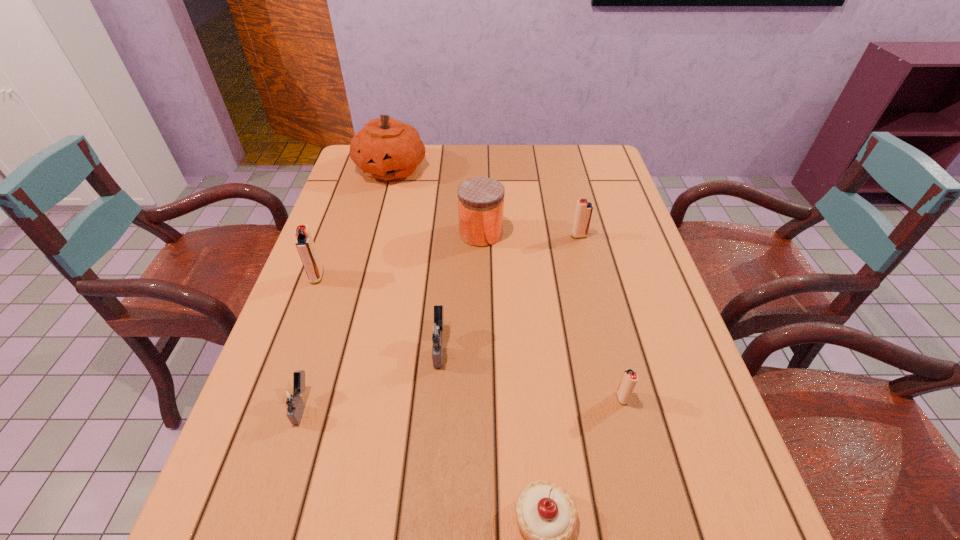
Image resolution: width=960 pixels, height=540 pixels. I want to click on the smaller gray igniter, so click(x=290, y=397).

You are a GUI agent. You are given a task and a screenshot of the screen. Output one action in this format:
    pyautogui.click(x=<x>, y=<y>)
    Task: Click on the fourth igniter from right to left
    The width and height of the screenshot is (960, 540).
    Given the screenshot: What is the action you would take?
    pyautogui.click(x=290, y=397)

You are a GUI agent. You are given a task and a screenshot of the screen. Output one action in this format:
    pyautogui.click(x=<x>, y=<y>)
    Task: Click on the free space located 0.340m on the front-facing side of the pumpkin
    This screenshot has width=960, height=540.
    Given the screenshot: What is the action you would take?
    click(x=366, y=264)

Find the location of a particular element. The height and width of the screenshot is (540, 960). vacant space situated 0.270m on the back of the second farthest igniter is located at coordinates (343, 206).

Image resolution: width=960 pixels, height=540 pixels. Find the location of `free space located 0.180m on the front of the jar`. free space located 0.180m on the front of the jar is located at coordinates coord(481,297).

Image resolution: width=960 pixels, height=540 pixels. I want to click on vacant space located 0.360m on the right of the third igniter from right to left, so click(x=621, y=346).

Find the location of a particular element. free space located on the right of the second smallest red igniter is located at coordinates (610, 236).

The width and height of the screenshot is (960, 540). I want to click on vacant space situated 0.310m on the back of the smallest red igniter, so click(x=592, y=279).

I want to click on free space located on the right of the second igniter from left to right, so click(475, 404).

Image resolution: width=960 pixels, height=540 pixels. Identify the location of object at the far edge. (387, 149).